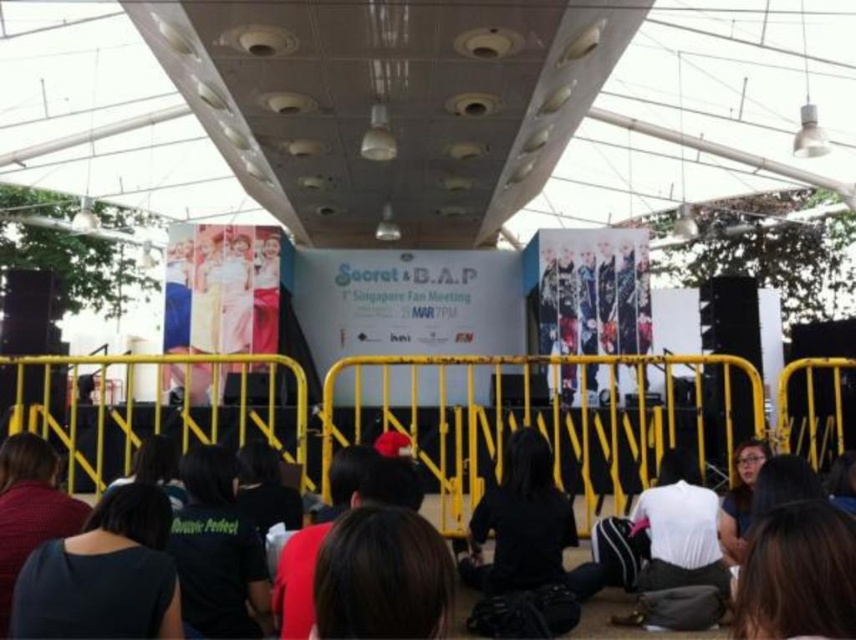
You are a photographer at the event and want to take a photo of the dark blue fabric at lower left and the black fabric crowd at lower center. Which object will appear larger in the photo?

The dark blue fabric at lower left is taller than the black fabric crowd at lower center, so it will appear larger in the photo.

You are a photographer at the event and want to capture the dark blue fabric at lower left and the black fabric crowd at lower center in a single shot. Based on their widths, do you think you can fit both into the frame without cropping either?

The dark blue fabric at lower left might be wider than black fabric crowd at lower center, so there is a possibility that both can fit into the frame if the camera is positioned appropriately to accommodate their widths.